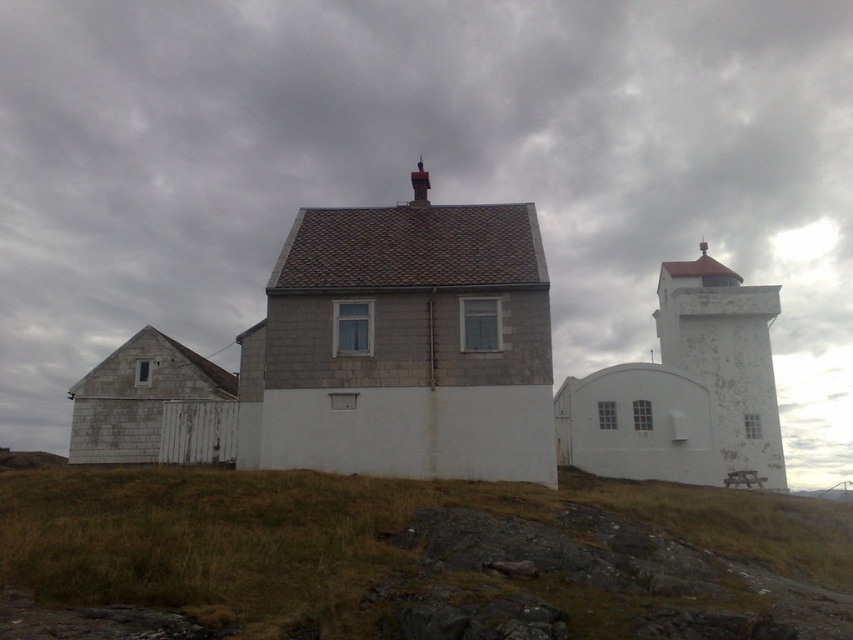
Question: Can you confirm if green grass at center is smaller than white painted concrete tower at right?

Choices:
 (A) yes
 (B) no

Answer: (B)

Question: Does white stone house at center appear over white painted concrete tower at right?

Choices:
 (A) yes
 (B) no

Answer: (A)

Question: Estimate the real-world distances between objects in this image. Which object is farther from the green grass at center?

Choices:
 (A) white painted concrete tower at right
 (B) white stone house at center

Answer: (A)

Question: Which of the following is the farthest from the observer?

Choices:
 (A) (431, 355)
 (B) (759, 324)

Answer: (B)

Question: Which point is closer to the camera?

Choices:
 (A) (750, 317)
 (B) (363, 557)

Answer: (B)

Question: Does white stone house at center appear under white painted concrete tower at right?

Choices:
 (A) no
 (B) yes

Answer: (A)